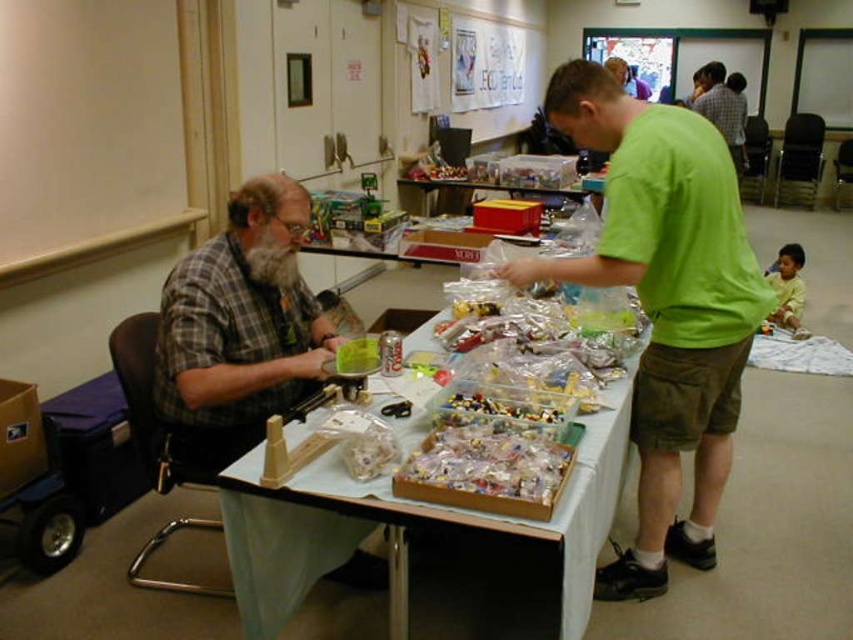
Question: Is the position of matte white board at upper left less distant than that of translucent plastic table at center?

Choices:
 (A) yes
 (B) no

Answer: (A)

Question: Is plaid shirt at left behind matte white board at upper left?

Choices:
 (A) yes
 (B) no

Answer: (B)

Question: Among these points, which one is nearest to the camera?

Choices:
 (A) (193, 13)
 (B) (242, 317)
 (C) (245, 621)

Answer: (C)

Question: Which of these objects is positioned closest to the matte white board at upper left?

Choices:
 (A) green matte shirt at center
 (B) plaid shirt at left
 (C) translucent plastic table at center

Answer: (B)

Question: Among these points, which one is farthest from the camera?

Choices:
 (A) (561, 524)
 (B) (689, 106)
 (C) (618, 205)

Answer: (B)

Question: Is green matte shirt at center smaller than plaid shirt at left?

Choices:
 (A) yes
 (B) no

Answer: (B)